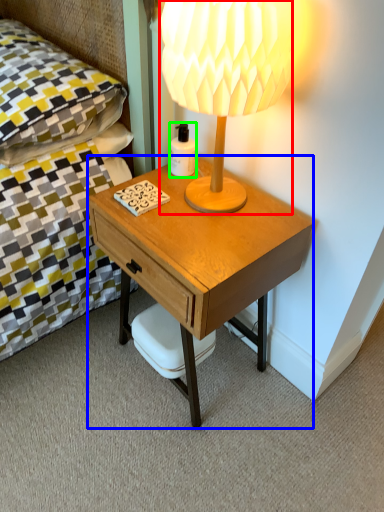
Question: Considering the real-world distances, which object is closest to lamp (highlighted by a red box)? desk (highlighted by a blue box) or bottle (highlighted by a green box).

Choices:
 (A) desk
 (B) bottle

Answer: (A)